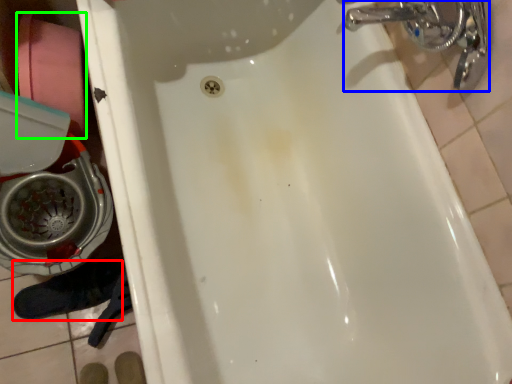
Question: Considering the real-world distances, which object is farthest from shoe (highlighted by a red box)? plumbing fixture (highlighted by a blue box) or toilet paper (highlighted by a green box)?

Choices:
 (A) plumbing fixture
 (B) toilet paper

Answer: (A)